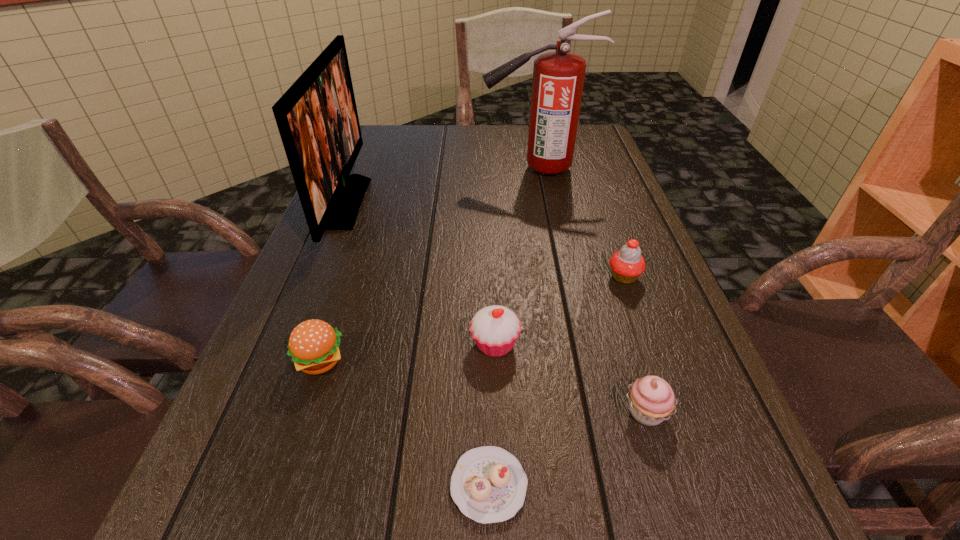
Where is `blank space that satisfies the following two spatial constraints: 1. on the back side of the nearest cupcake; 2. on the left side of the farthest cupcake`? blank space that satisfies the following two spatial constraints: 1. on the back side of the nearest cupcake; 2. on the left side of the farthest cupcake is located at coordinates (486, 277).

Find the location of a particular element. vacant space that satisfies the following two spatial constraints: 1. at the nozzle of the tallest object; 2. on the left side of the fifth nearest object is located at coordinates (558, 277).

Find the location of a particular element. Image resolution: width=960 pixels, height=540 pixels. vacant area in the image that satisfies the following two spatial constraints: 1. on the back side of the shortest object; 2. on the front-facing side of the sixth shortest object is located at coordinates (485, 203).

The width and height of the screenshot is (960, 540). I want to click on vacant area in the image that satisfies the following two spatial constraints: 1. at the nozzle of the fire extinguisher; 2. on the right side of the farthest cupcake, so click(558, 277).

Where is `free space that satisfies the following two spatial constraints: 1. on the front-facing side of the farthest cupcake; 2. on the right side of the monitor`? free space that satisfies the following two spatial constraints: 1. on the front-facing side of the farthest cupcake; 2. on the right side of the monitor is located at coordinates (315, 277).

The width and height of the screenshot is (960, 540). In order to click on vacant point that satisfies the following two spatial constraints: 1. on the front-facing side of the monitor; 2. on the left side of the hamburger in this screenshot , I will do `click(280, 361)`.